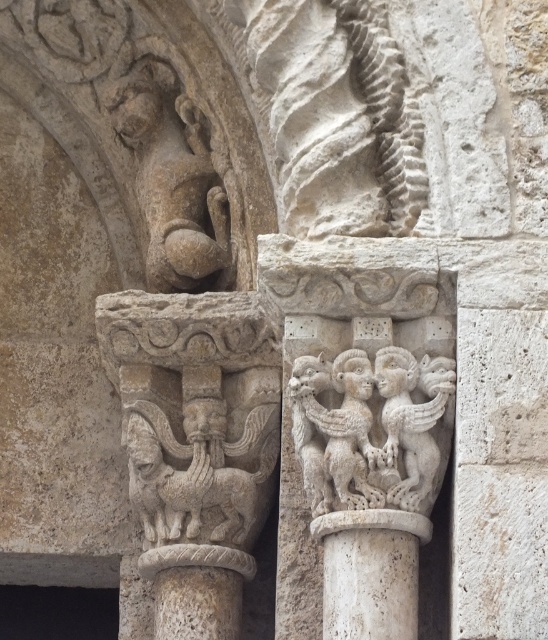
You are an art student examining the intricate carvings on the columns. You notice the carved stone gargoyle at upper left and the carved stone lion at center. Which of these two carvings is positioned closer to your viewpoint?

The carved stone gargoyle at upper left is closer to the viewer than the carved stone lion at center.